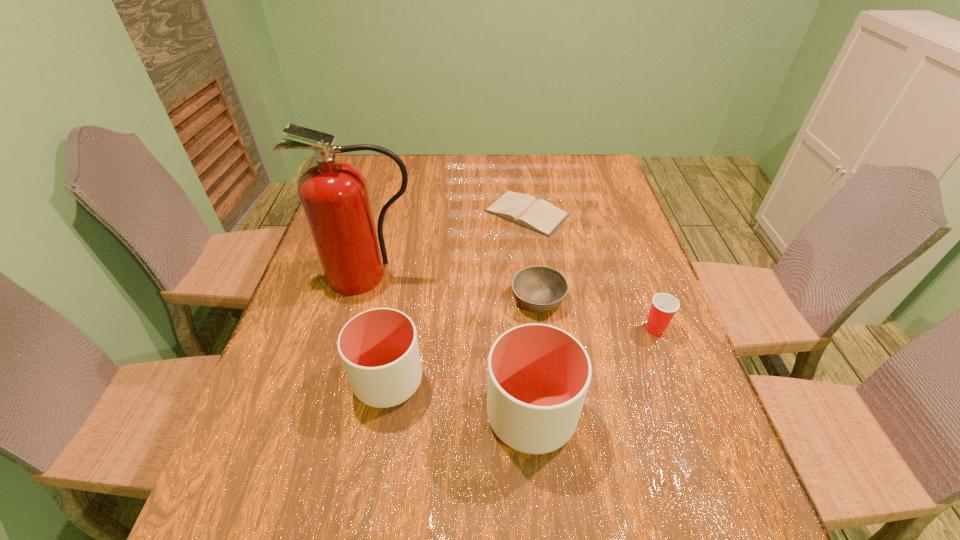
The height and width of the screenshot is (540, 960). In order to click on free region located on the back of the left cup in this screenshot , I will do `click(397, 328)`.

Image resolution: width=960 pixels, height=540 pixels. I want to click on vacant space located 0.260m on the left of the right cup, so (x=357, y=415).

Find the location of a particular element. vacant point located 0.280m on the front of the Bible is located at coordinates (539, 308).

Find the location of `free space located 0.180m with the handle and nozzle on the tallest object`. free space located 0.180m with the handle and nozzle on the tallest object is located at coordinates (348, 354).

The width and height of the screenshot is (960, 540). In order to click on free location located on the back of the fourth tallest object in this screenshot , I will do `click(644, 298)`.

Locate an element on the screen. free space located on the back of the bowl is located at coordinates (529, 225).

The width and height of the screenshot is (960, 540). I want to click on object that is at the near edge, so click(x=538, y=376).

You are a GUI agent. You are given a task and a screenshot of the screen. Output one action in this format:
    pyautogui.click(x=<x>, y=<y>)
    Task: Click on the object that is at the left edge
    
    Given the screenshot: What is the action you would take?
    pyautogui.click(x=334, y=195)

This screenshot has height=540, width=960. I want to click on object that is at the right edge, so click(664, 306).

Locate an element on the screen. vacant space at the far edge is located at coordinates (459, 167).